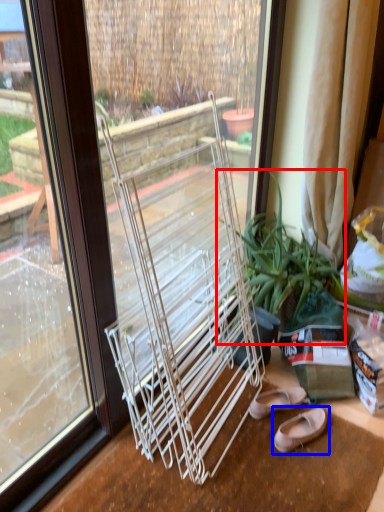
Question: Which object appears closest to the camera in this image, houseplant (highlighted by a red box) or footwear (highlighted by a blue box)?

Choices:
 (A) houseplant
 (B) footwear

Answer: (A)